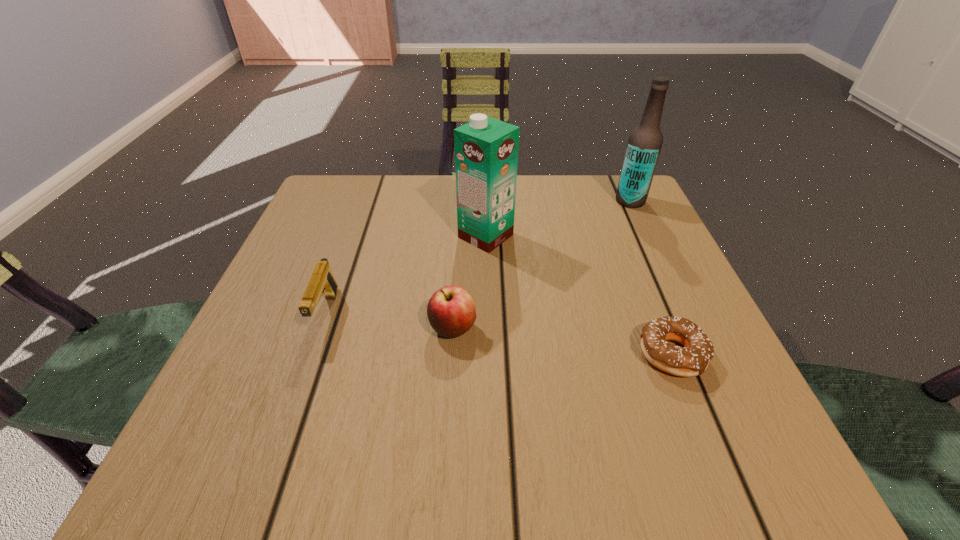
The width and height of the screenshot is (960, 540). In order to click on vacant position in the image that satisfies the following two spatial constraints: 1. at the barrel of the pistol; 2. on the right side of the apple in this screenshot , I will do `click(321, 328)`.